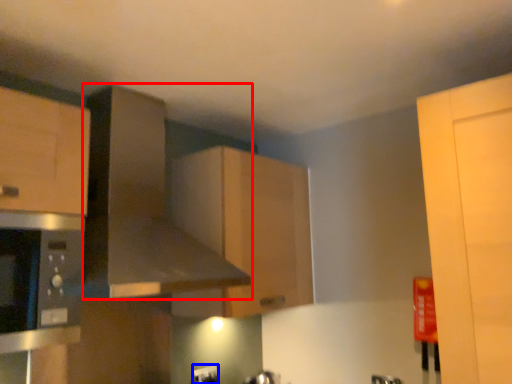
Question: Which object appears closest to the camera in this image, exhaust hood (highlighted by a red box) or electric outlet (highlighted by a blue box)?

Choices:
 (A) exhaust hood
 (B) electric outlet

Answer: (A)